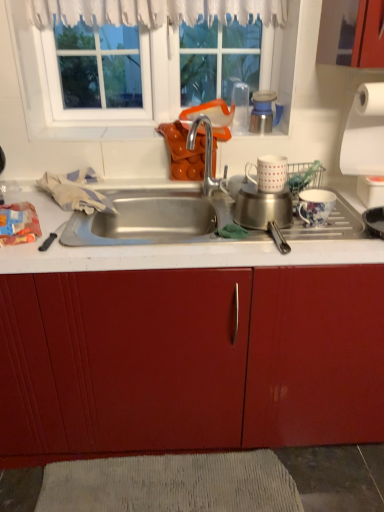
Question: From a real-world perspective, is silver metallic faucet at center below white paper at right?

Choices:
 (A) yes
 (B) no

Answer: (A)

Question: Considering the relative sizes of silver metallic faucet at center and white paper at right in the image provided, is silver metallic faucet at center taller than white paper at right?

Choices:
 (A) yes
 (B) no

Answer: (B)

Question: Does silver metallic faucet at center have a lesser width compared to white paper at right?

Choices:
 (A) yes
 (B) no

Answer: (A)

Question: Is silver metallic faucet at center located outside white paper at right?

Choices:
 (A) yes
 (B) no

Answer: (A)

Question: Does silver metallic faucet at center appear on the left side of white paper at right?

Choices:
 (A) no
 (B) yes

Answer: (B)

Question: Is silver metallic faucet at center turned away from white paper at right?

Choices:
 (A) yes
 (B) no

Answer: (B)

Question: From a real-world perspective, is white glass window at upper center located beneath brushed metal cup at upper center?

Choices:
 (A) no
 (B) yes

Answer: (A)

Question: Is brushed metal cup at upper center located within white glass window at upper center?

Choices:
 (A) yes
 (B) no

Answer: (B)

Question: From a real-world perspective, is white glass window at upper center located higher than brushed metal cup at upper center?

Choices:
 (A) no
 (B) yes

Answer: (B)

Question: Is brushed metal cup at upper center at the back of white glass window at upper center?

Choices:
 (A) no
 (B) yes

Answer: (A)

Question: Is white glass window at upper center aimed at brushed metal cup at upper center?

Choices:
 (A) no
 (B) yes

Answer: (B)

Question: Can you confirm if white glass window at upper center is positioned to the right of brushed metal cup at upper center?

Choices:
 (A) yes
 (B) no

Answer: (B)

Question: Can you confirm if white glass window at upper center is taller than white textured mat at lower center?

Choices:
 (A) yes
 (B) no

Answer: (A)